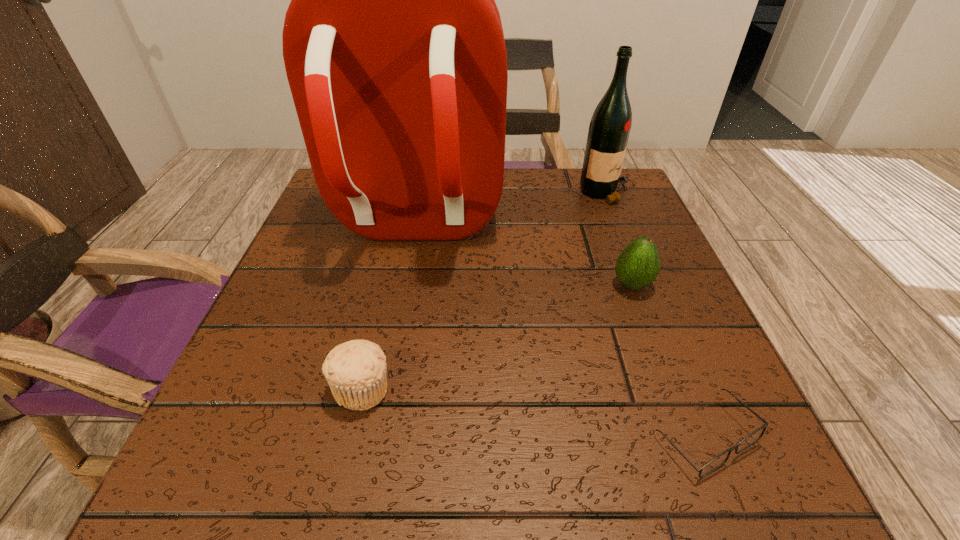
The image size is (960, 540). Identify the location of wine bottle situated at the far edge. (610, 125).

I want to click on object that is at the near edge, so click(745, 443).

The image size is (960, 540). What are the coordinates of `backpack situated at the left edge` in the screenshot? It's located at (393, 45).

What are the coordinates of `muffin at the left edge` in the screenshot? It's located at (355, 370).

Find the location of a particular element. wine bottle located in the right edge section of the desktop is located at coordinates (610, 125).

This screenshot has height=540, width=960. Find the location of `avocado that is at the right edge`. avocado that is at the right edge is located at coordinates (637, 266).

The width and height of the screenshot is (960, 540). In order to click on spectacles that is positioned at the right edge in this screenshot , I will do `click(745, 443)`.

Identify the location of object located in the far left corner section of the desktop. (393, 45).

Find the location of a particular element. This screenshot has height=540, width=960. object at the far right corner is located at coordinates (610, 125).

This screenshot has width=960, height=540. In order to click on object positioned at the near right corner in this screenshot , I will do `click(745, 443)`.